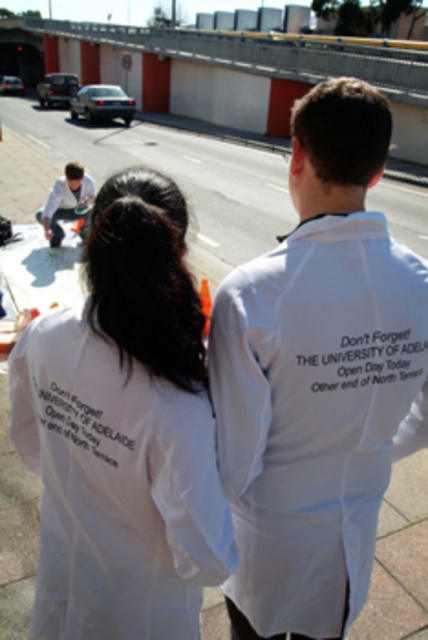
You are a photographer trying to capture a group photo of the two people wearing white cotton shirt at center and matte white shirt at lower left. Since you want to make sure both are visible, which one should you position closer to the camera to avoid being blocked by the other?

The matte white shirt at lower left should be positioned closer to the camera because the white cotton shirt at center is taller than matte white shirt at lower left, so placing the shorter one closer will prevent it from being blocked by the taller one.

You are standing at the point labeled as point (82, 544) and want to walk towards the road with vehicles. Is the point labeled as point (360, 272) closer to the road than your current position?

Point (360, 272) is closer to the camera than point (82, 544). Since you are at point (82, 544), which is farther from the camera, the road is likely behind point (360, 272). Therefore, point (360, 272) is closer to the road than your current position.